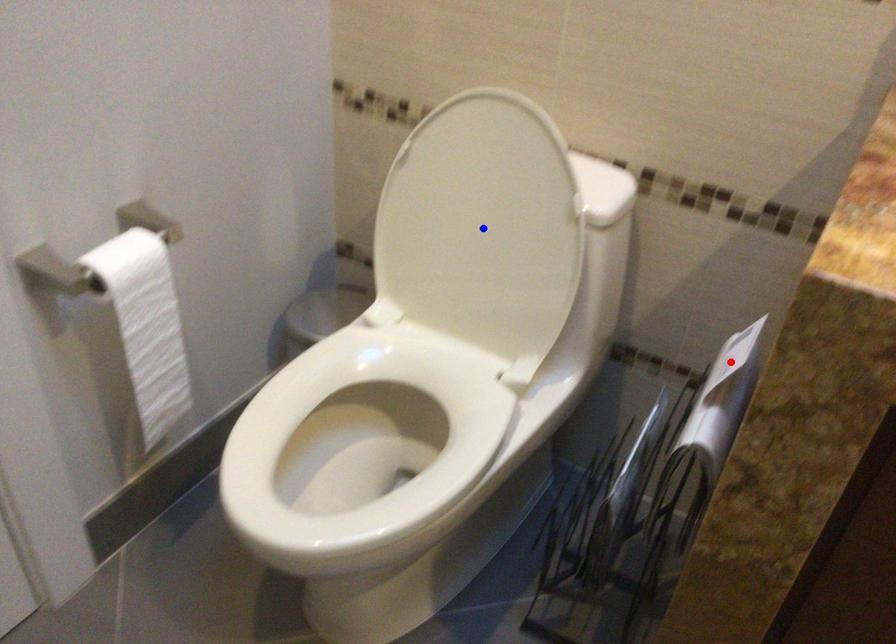
Question: In the image, two points are highlighted. Which point is nearer to the camera? Reply with the corresponding letter.

Choices:
 (A) blue point
 (B) red point

Answer: (B)